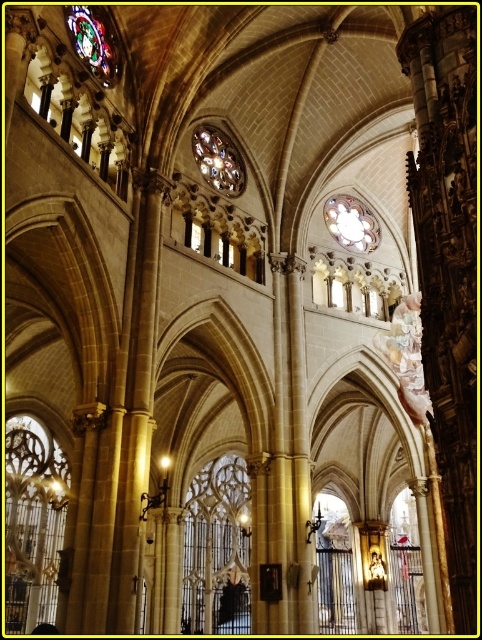
Question: Is clear glass window at lower left wider than stained glass window at upper left?

Choices:
 (A) no
 (B) yes

Answer: (B)

Question: Does clear glass window at center have a larger size compared to multicolored stained glass at upper center?

Choices:
 (A) no
 (B) yes

Answer: (B)

Question: Among these points, which one is nearest to the camera?

Choices:
 (A) (339, 225)
 (B) (10, 436)
 (C) (93, 13)
 (D) (200, 499)

Answer: (C)

Question: Which object is the farthest from the clear glass window at center?

Choices:
 (A) stained glass window at upper left
 (B) multicolored stained glass at upper center
 (C) clear glass window at lower left
 (D) matte glass clock at center

Answer: (A)

Question: Among these objects, which one is farthest from the camera?

Choices:
 (A) clear glass window at lower left
 (B) multicolored stained glass at upper center
 (C) matte glass clock at center

Answer: (A)

Question: Does clear glass window at center have a larger size compared to matte glass clock at center?

Choices:
 (A) no
 (B) yes

Answer: (B)